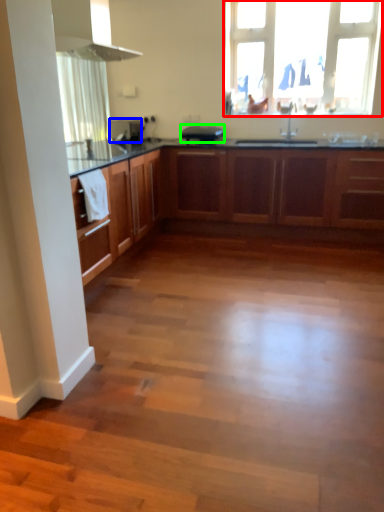
Question: Which object is positioned farthest from window (highlighted by a red box)? Select from appliance (highlighted by a blue box) and appliance (highlighted by a green box).

Choices:
 (A) appliance
 (B) appliance

Answer: (A)